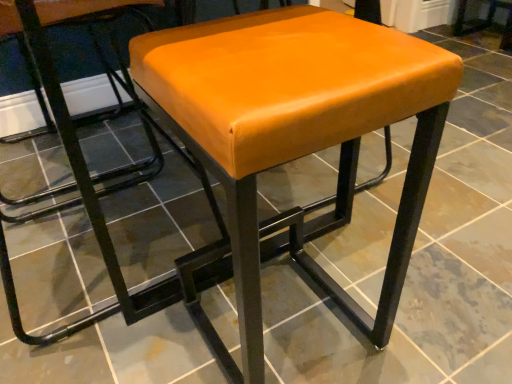
The height and width of the screenshot is (384, 512). What are the coordinates of `vacant area to the left of orange leather stool at center` in the screenshot? It's located at (138, 321).